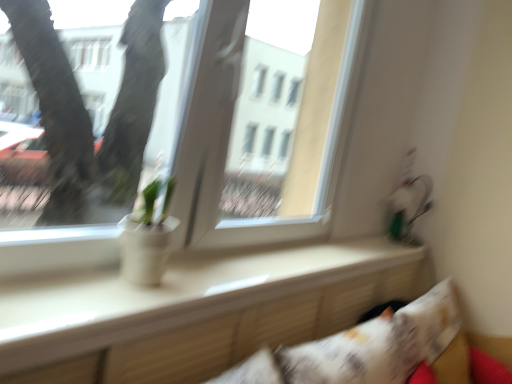
Question: Is white glossy window sill at center inside or outside of white matte pot at center?

Choices:
 (A) outside
 (B) inside

Answer: (A)

Question: From a real-world perspective, is white glossy window sill at center positioned above or below white matte pot at center?

Choices:
 (A) above
 (B) below

Answer: (B)

Question: Based on their relative distances, which object is farther from the transparent glass window at center?

Choices:
 (A) white matte pot at center
 (B) white printed pillow at lower right
 (C) white glossy window sill at center

Answer: (B)

Question: Considering the real-world distances, which object is farthest from the transparent glass window at center?

Choices:
 (A) white printed pillow at lower right
 (B) white matte pot at center
 (C) white glossy window sill at center

Answer: (A)